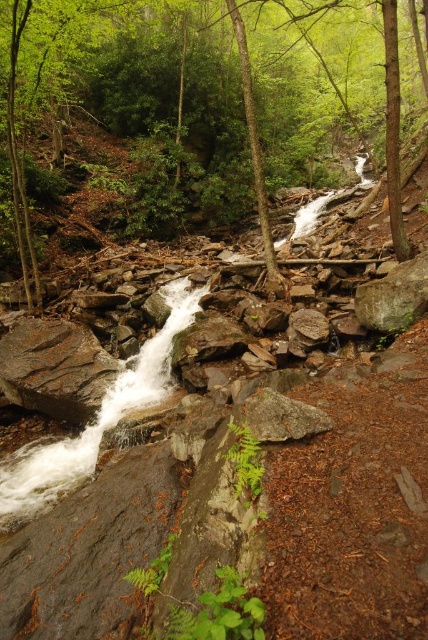
Who is shorter, green leafy tree at center or rusty metallic rock at lower left?

rusty metallic rock at lower left is shorter.

Can you confirm if green leafy tree at center is positioned to the left of rusty metallic rock at lower left?

In fact, green leafy tree at center is to the right of rusty metallic rock at lower left.

Where is `green leafy tree at center`? The height and width of the screenshot is (640, 428). green leafy tree at center is located at coordinates (238, 113).